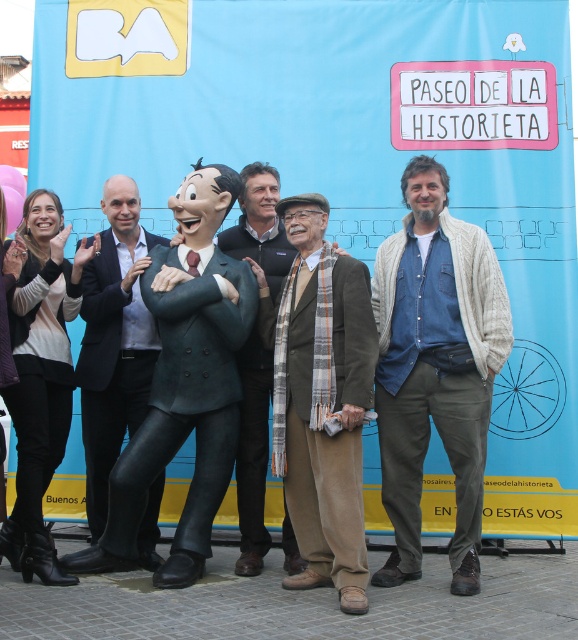
You are a photographer trying to adjust the lighting for the group photo. You notice the brown woolen suit at center and the brown wool scarf at center. Which item is located lower in the scene?

The brown woolen suit at center is positioned under the brown wool scarf at center, so the suit is lower than the scarf.

You are organizing a costume party and need to ensure that the brown wool scarf at center can fit into a storage box designed to hold the brown woolen suit at center. Based on the image, will the scarf fit inside the box?

The brown woolen suit at center is bigger than the brown wool scarf at center, so the scarf should fit inside the box designed for the suit.

You are organizing a photo shoot and need to ensure that the denim shirt at center and the matte green suit at center are visible in the final image. Given their sizes, which one might require more space in the frame to maintain clarity?

The denim shirt at center has a larger size compared to the matte green suit at center, so it would require more space in the frame to maintain clarity.